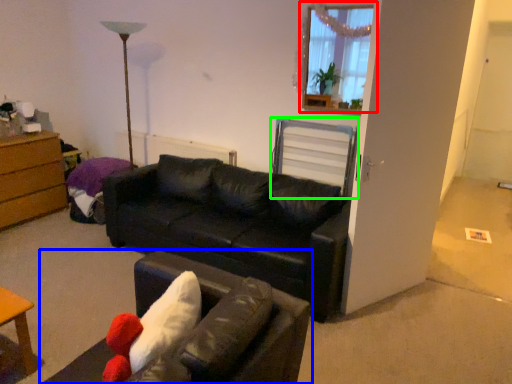
Question: Estimate the real-world distances between objects in this image. Which object is closer to window (highlighted by a red box), studio couch (highlighted by a blue box) or swivel chair (highlighted by a green box)?

Choices:
 (A) studio couch
 (B) swivel chair

Answer: (B)